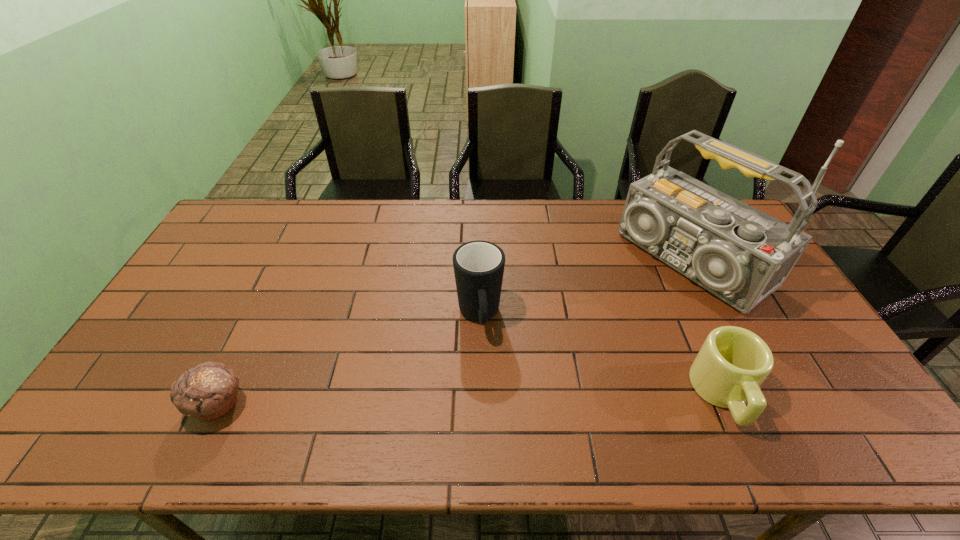
Locate an element on the screen. This screenshot has height=540, width=960. unoccupied area between the muffin and the radio receiver is located at coordinates (455, 332).

Identify the location of vacant space that's between the left mug and the muffin. (348, 360).

Where is `free point between the left mug and the muffin`? The image size is (960, 540). free point between the left mug and the muffin is located at coordinates (348, 360).

The height and width of the screenshot is (540, 960). I want to click on object that is the closest to the shortest object, so click(478, 265).

This screenshot has width=960, height=540. Find the location of `object that is the third closest to the tallest object`. object that is the third closest to the tallest object is located at coordinates (208, 391).

Find the location of a particular element. Image resolution: width=960 pixels, height=540 pixels. vacant point that satisfies the following two spatial constraints: 1. on the back side of the muffin; 2. on the left side of the third shortest object is located at coordinates (259, 316).

You are a GUI agent. You are given a task and a screenshot of the screen. Output one action in this format:
    pyautogui.click(x=<x>, y=<y>)
    Task: Click on the vacant point that satisfies the following two spatial constraints: 1. on the back side of the farther mug; 2. on the left side of the shortest object
    
    Given the screenshot: What is the action you would take?
    pyautogui.click(x=259, y=316)

Where is `free space that satisfies the following two spatial constraints: 1. on the back side of the leftmost object; 2. on the left side of the second tallest object`? This screenshot has width=960, height=540. free space that satisfies the following two spatial constraints: 1. on the back side of the leftmost object; 2. on the left side of the second tallest object is located at coordinates (259, 316).